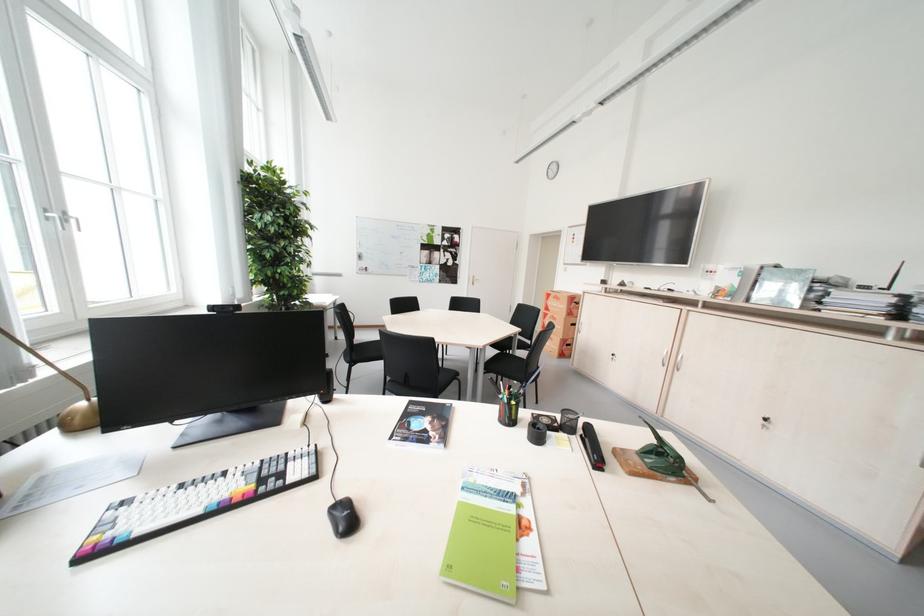
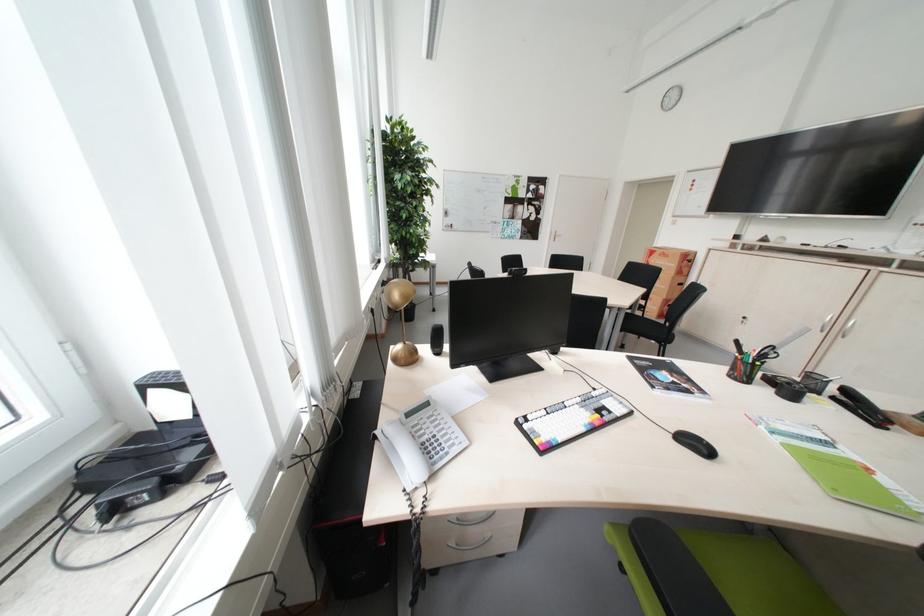
Question: The images are taken continuously from a first-person perspective. In which direction are you moving?

Choices:
 (A) Left
 (B) Right
 (C) Forward
 (D) Backward

Answer: (A)